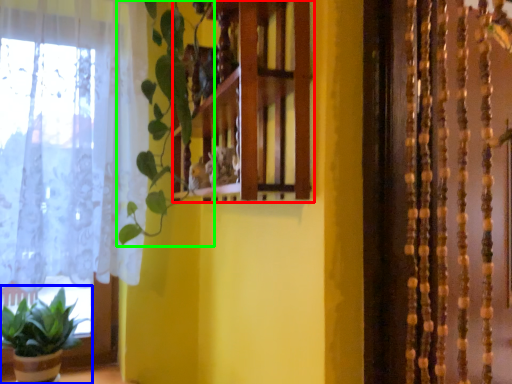
Question: Based on their relative distances, which object is farther from shelf (highlighted by a red box)? Choose from houseplant (highlighted by a blue box) and vegetation (highlighted by a green box).

Choices:
 (A) houseplant
 (B) vegetation

Answer: (A)